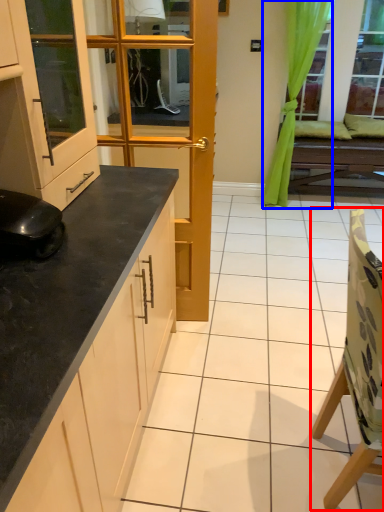
Question: Which point is closer to the camera, chair (highlighted by a red box) or curtain (highlighted by a blue box)?

Choices:
 (A) chair
 (B) curtain

Answer: (A)